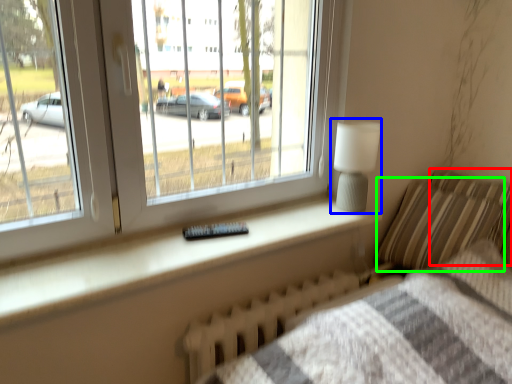
Question: Which object is the farthest from pillow (highlighted by a red box)? Choose among these: table lamp (highlighted by a blue box) or pillow (highlighted by a green box).

Choices:
 (A) table lamp
 (B) pillow

Answer: (A)